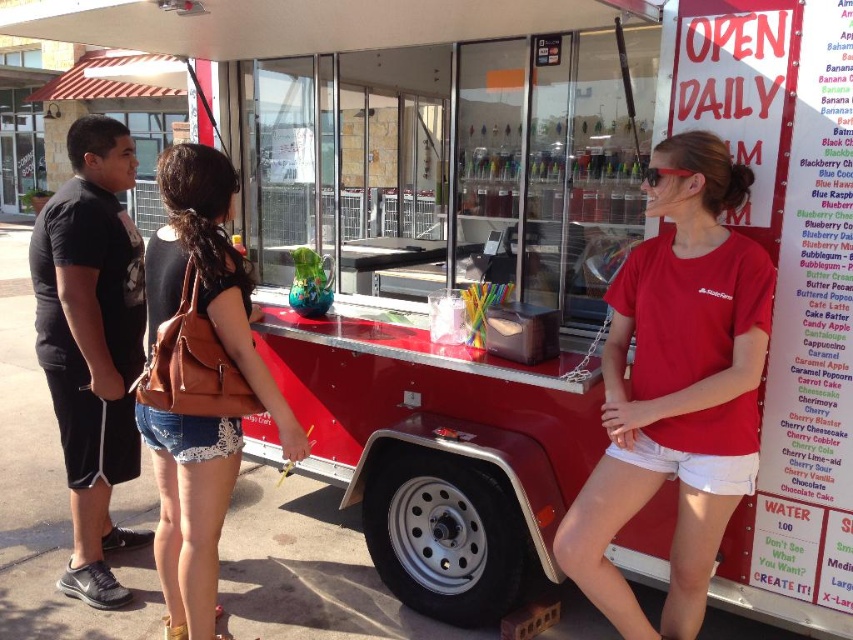
Question: Is red cotton t-shirt at center to the left of brown leather backpack at center from the viewer's perspective?

Choices:
 (A) no
 (B) yes

Answer: (A)

Question: Can you confirm if brown leather backpack at center is positioned below black cotton t-shirt at left?

Choices:
 (A) yes
 (B) no

Answer: (A)

Question: Which of the following is the farthest from the observer?

Choices:
 (A) (653, 292)
 (B) (68, 400)

Answer: (B)

Question: Which object is positioned farthest from the red cotton t-shirt at center?

Choices:
 (A) black cotton t-shirt at left
 (B) brown leather backpack at center

Answer: (A)

Question: Does brown leather backpack at center come behind black cotton t-shirt at left?

Choices:
 (A) no
 (B) yes

Answer: (A)

Question: Which of these objects is positioned farthest from the brown leather backpack at center?

Choices:
 (A) black cotton t-shirt at left
 (B) red cotton t-shirt at center

Answer: (B)